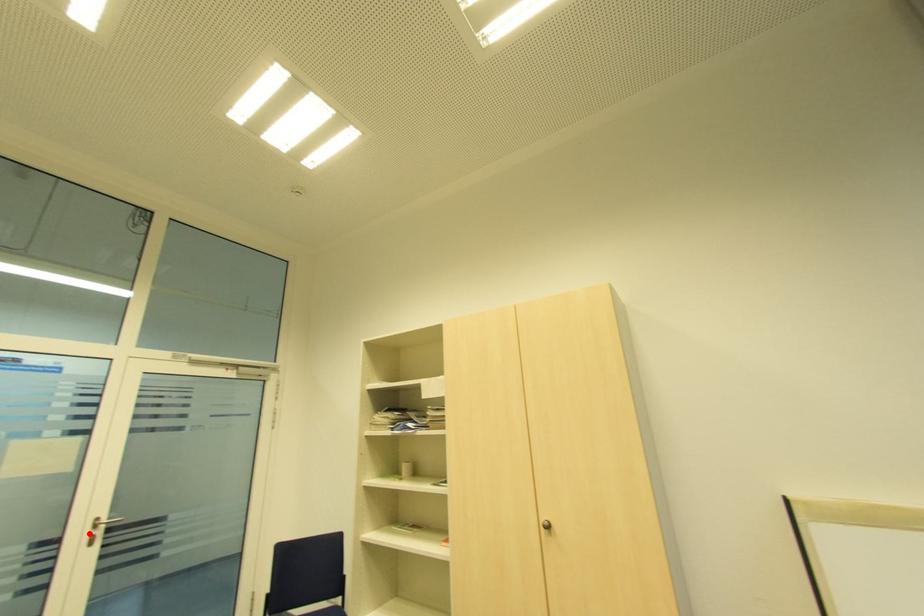
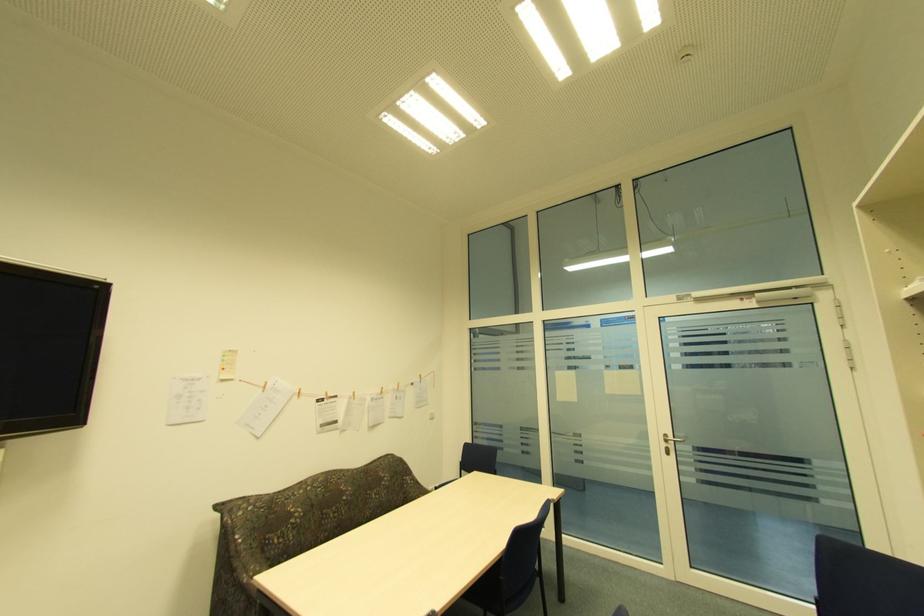
Question: I am providing you with two images of the same scene from different viewpoints. Given a red point in image1, look at the same physical point in image2. Is it:

Choices:
 (A) Closer to the viewpoint
 (B) Farther from the viewpoint

Answer: (B)